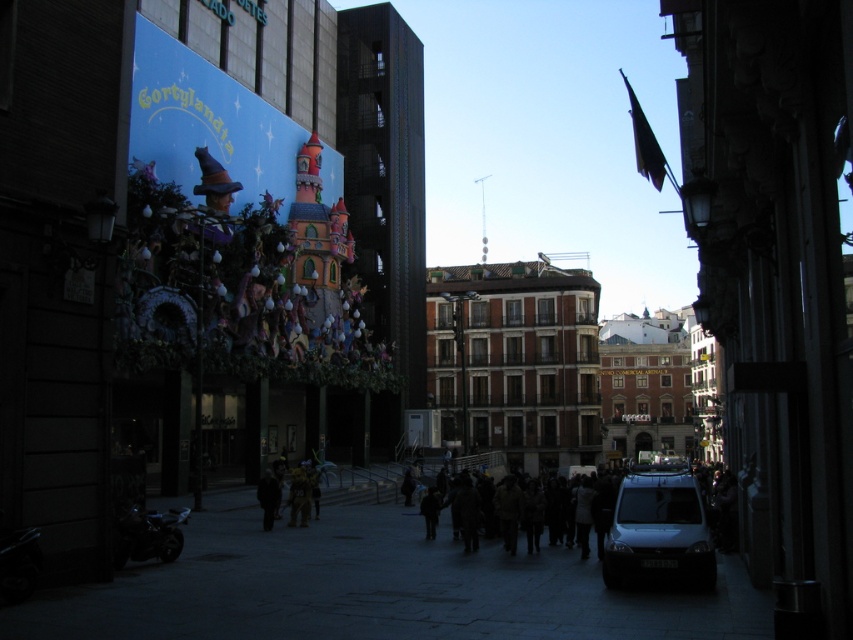
You are standing at the camera position in the urban street scene. There are two points marked on the image, one at coordinates point (566, 620) and another at point (613, 493). Which point is closer to you?

Point (566, 620) is closer to the camera than point (613, 493).

You are a delivery person trying to navigate through the dark brown fabric crowd at center and the black matte jacket at center on an urban street. Which object should you avoid to move more freely?

The dark brown fabric crowd at center is bigger than the black matte jacket at center, so you should avoid the dark brown fabric crowd at center to move more freely.

You are a delivery person needing to pass through the street between the white matte van at lower right and the dark brown fabric crowd at center. The van is 2.5 meters wide. Your delivery cart is 2 meters wide. Can you safely navigate through the space between them?

The white matte van at lower right might be wider than the dark brown fabric crowd at center. Since the van is 2.5 meters wide and your cart is 2 meters wide, there might be enough space if the crowd is narrower. However, the exact width of the crowd isn not specified, so proceed with caution.